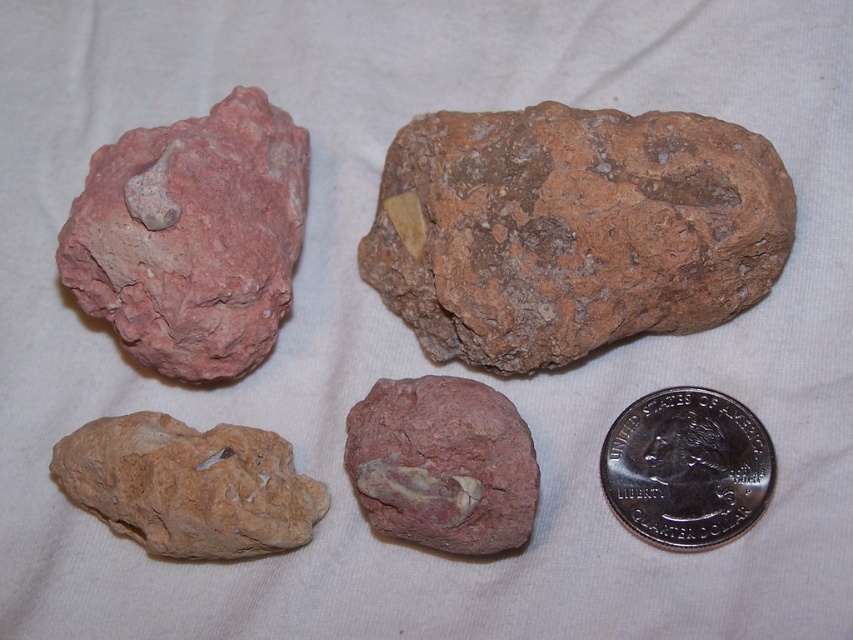
Question: Is brown matte rock at upper center wider than pink rough rock at upper left?

Choices:
 (A) yes
 (B) no

Answer: (A)

Question: Which of these objects is positioned farthest from the silver/smooth quarter at upper right?

Choices:
 (A) brown matte rock at upper center
 (B) matte stone rock at center
 (C) pink rough rock at upper left

Answer: (C)

Question: Which of the following is the farthest from the observer?

Choices:
 (A) (131, 291)
 (B) (733, 474)
 (C) (730, 257)
 (D) (415, 500)

Answer: (A)

Question: Is brown matte rock at upper center to the left of matte stone rock at center from the viewer's perspective?

Choices:
 (A) yes
 (B) no

Answer: (B)

Question: Which of the following is the closest to the observer?

Choices:
 (A) (758, 476)
 (B) (425, 387)
 (C) (434, 348)
 (D) (86, 296)

Answer: (A)

Question: Does pink rough rock at upper left have a larger size compared to brown matte rock at lower left?

Choices:
 (A) no
 (B) yes

Answer: (B)